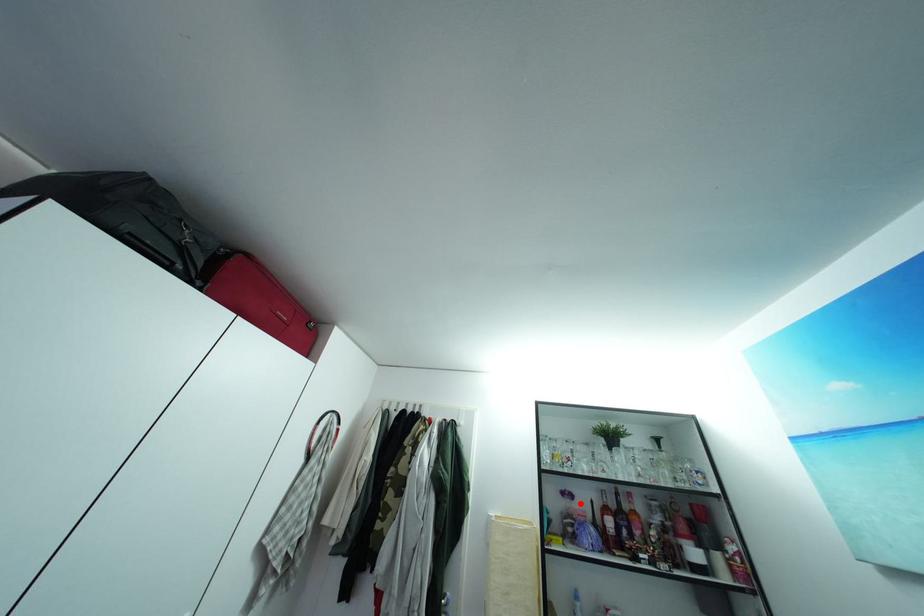
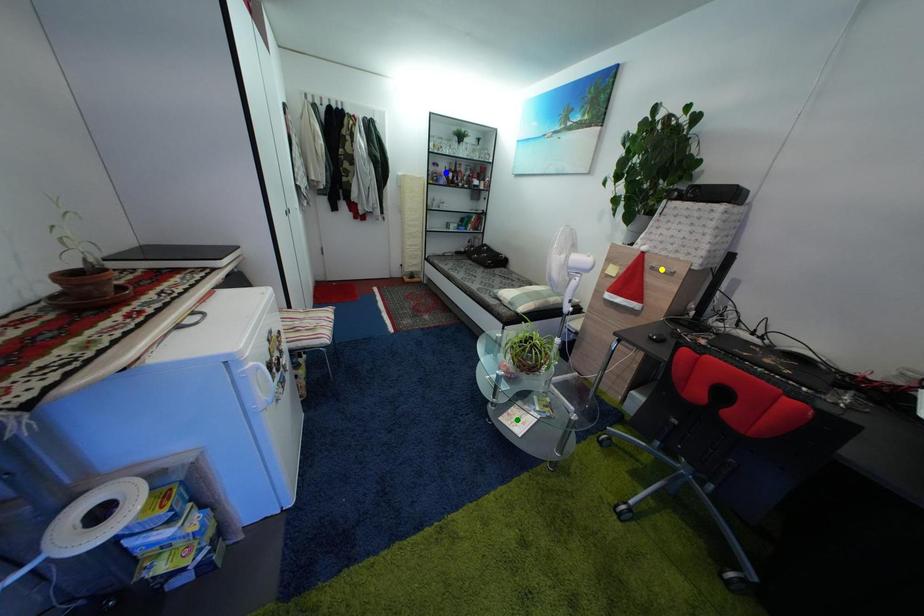
Question: I am providing you with two images of the same scene from different viewpoints. A red point is marked on the first image. You are given multiple points on the second image. Which point in image 2 represents the same 3d spot as the red point in image 1?

Choices:
 (A) yellow point
 (B) green point
 (C) blue point

Answer: (C)